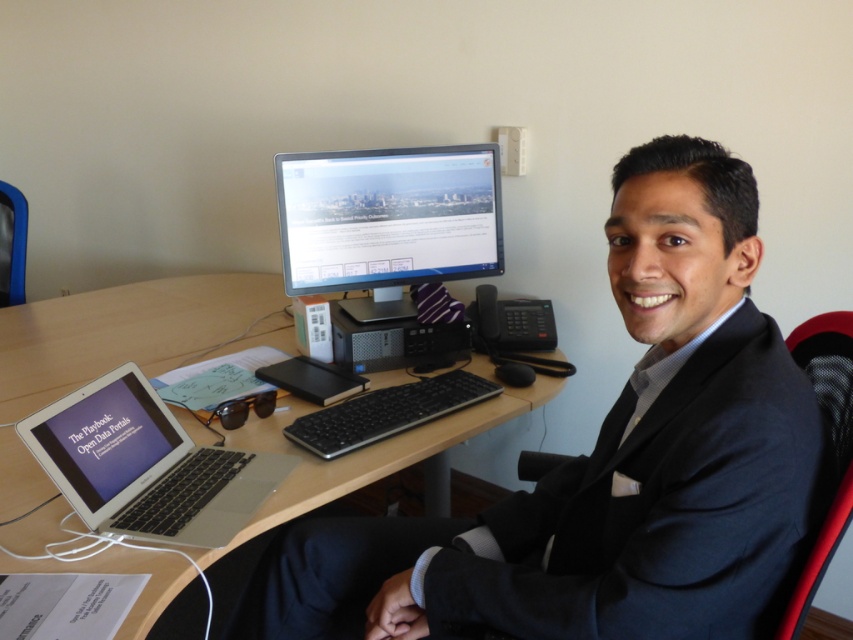
Does wooden at center appear over matte black monitor at center?

No.

Between wooden at center and matte black monitor at center, which one appears on the right side from the viewer's perspective?

From the viewer's perspective, matte black monitor at center appears more on the right side.

Does point (318, 460) come farther from viewer compared to point (335, 248)?

No.

You are a GUI agent. You are given a task and a screenshot of the screen. Output one action in this format:
    pyautogui.click(x=<x>, y=<y>)
    Task: Click on the wooden at center
    This screenshot has width=853, height=640.
    Given the screenshot: What is the action you would take?
    pyautogui.click(x=131, y=332)

Is dark blue suit at center closer to the viewer compared to matte black monitor at center?

Yes, dark blue suit at center is closer to the viewer.

Based on the photo, who is taller, dark blue suit at center or matte black monitor at center?

Standing taller between the two is dark blue suit at center.

Who is more distant from viewer, [444,570] or [413,193]?

The point [413,193] is behind.

You are a GUI agent. You are given a task and a screenshot of the screen. Output one action in this format:
    pyautogui.click(x=<x>, y=<y>)
    Task: Click on the dark blue suit at center
    Image resolution: width=853 pixels, height=640 pixels.
    Given the screenshot: What is the action you would take?
    pyautogui.click(x=612, y=465)

Can you confirm if black mesh chair at right is positioned to the right of black mesh chair at left?

Yes, black mesh chair at right is to the right of black mesh chair at left.

Does black mesh chair at right lie behind black mesh chair at left?

No, it is not.

What are the coordinates of `black mesh chair at right` in the screenshot? It's located at (827, 445).

Find the location of a particular element. black mesh chair at right is located at coordinates (827, 445).